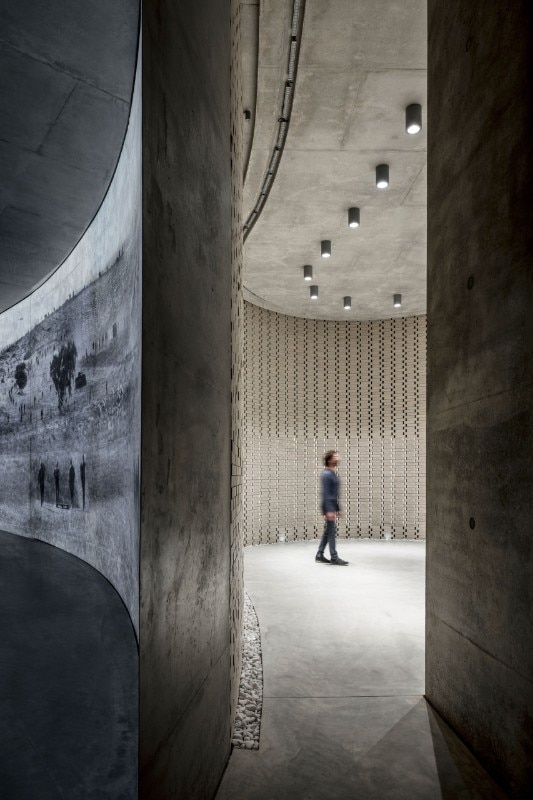
You are a GUI agent. You are given a task and a screenshot of the screen. Output one action in this format:
    pyautogui.click(x=<x>, y=<y>)
    Task: Click on the floor
    The height and width of the screenshot is (800, 533).
    Given the screenshot: What is the action you would take?
    pyautogui.click(x=368, y=662)